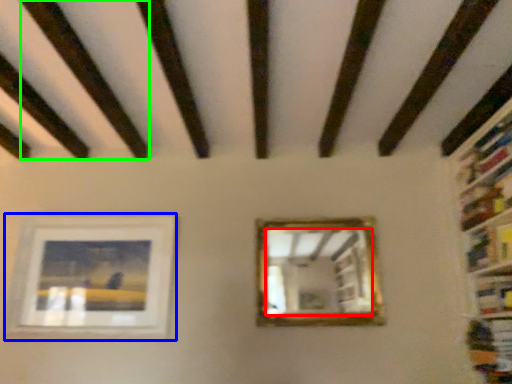
Question: Which object is positioned closest to mirror (highlighted by a red box)? Select from picture frame (highlighted by a blue box) and plank (highlighted by a green box).

Choices:
 (A) picture frame
 (B) plank

Answer: (A)